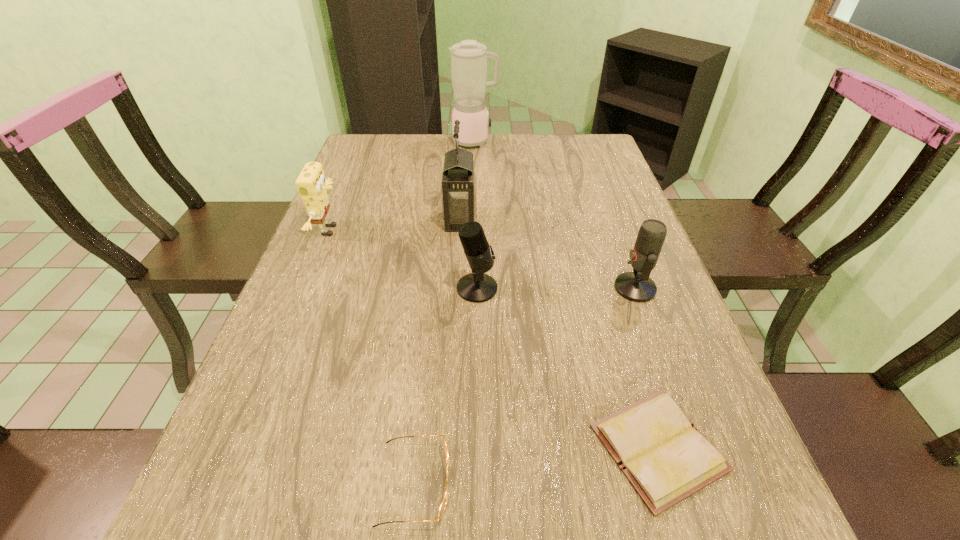
You are a GUI agent. You are given a task and a screenshot of the screen. Output one action in this format:
    pyautogui.click(x=<x>, y=<y>)
    Task: Click on the tallest object
    
    Given the screenshot: What is the action you would take?
    pyautogui.click(x=468, y=59)

At what (x,y) coordinates should I click in order to perform the action: click on the farthest object. Please return your answer as a coordinate pair (x, y). Image resolution: width=960 pixels, height=540 pixels. Looking at the image, I should click on (468, 59).

Where is `the sixth shortest object`? the sixth shortest object is located at coordinates (459, 183).

Find the location of a particular element. The width and height of the screenshot is (960, 540). the leftmost object is located at coordinates (312, 186).

What are the coordinates of `the left microphone` in the screenshot? It's located at (476, 287).

This screenshot has width=960, height=540. What are the coordinates of `the right microphone` in the screenshot? It's located at (637, 286).

Where is `the sixth tallest object`? The image size is (960, 540). the sixth tallest object is located at coordinates (443, 504).

Identify the location of diary. The height and width of the screenshot is (540, 960). (666, 459).

Find the location of a particular element. The width and height of the screenshot is (960, 540). vacant area situated on the base of the farthest object near the control knob is located at coordinates (559, 141).

The height and width of the screenshot is (540, 960). I want to click on blank area located 0.270m on the front-facing side of the lantern, so click(577, 220).